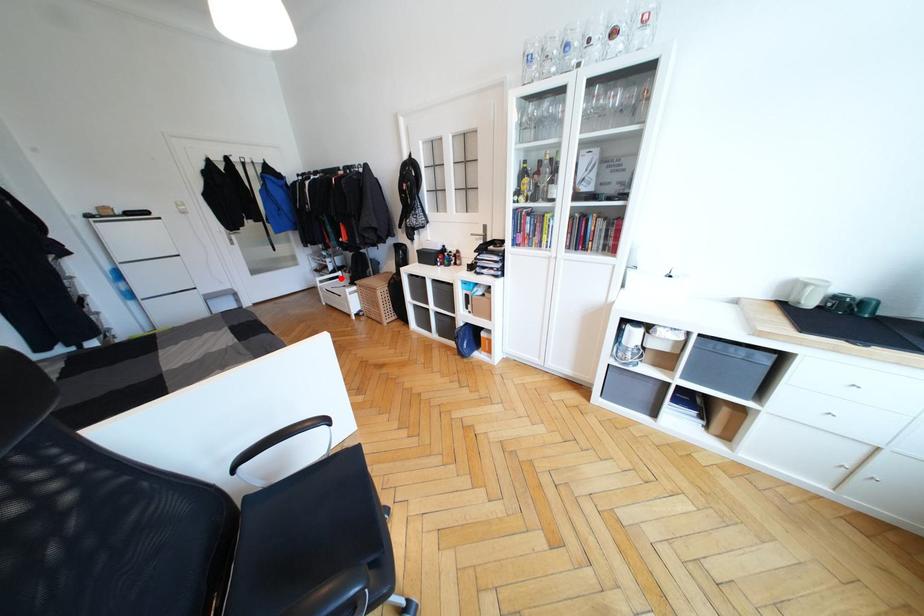
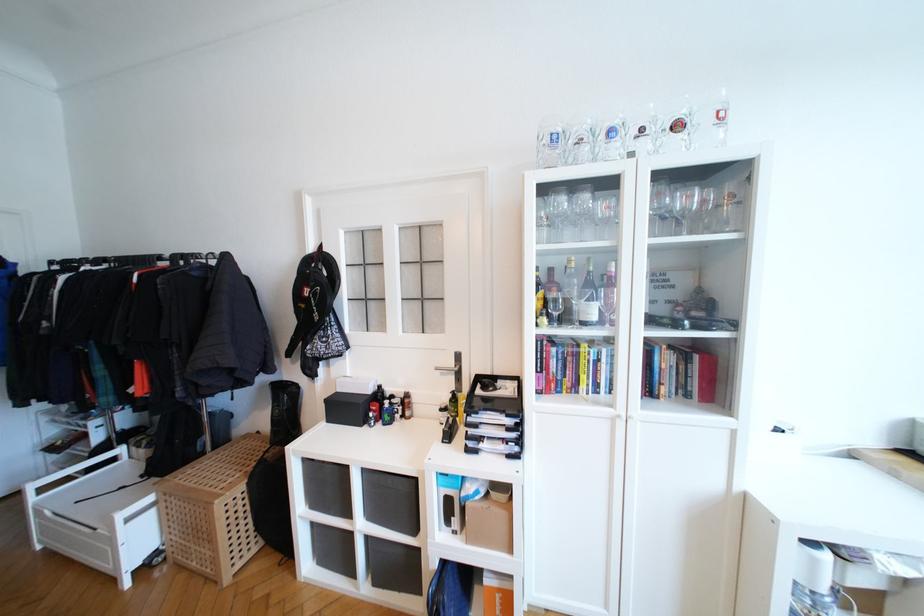
Question: I am providing you with two images of the same scene from different viewpoints. A red point is marked on the first image. At the location where the point appears in image 1, is it still visible in image 2?

Choices:
 (A) Yes
 (B) No

Answer: (A)